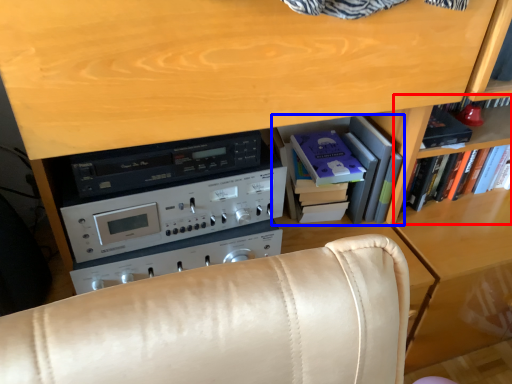
Question: Which object appears farthest to the camera in this image, shelf (highlighted by a red box) or shelf (highlighted by a blue box)?

Choices:
 (A) shelf
 (B) shelf

Answer: (A)